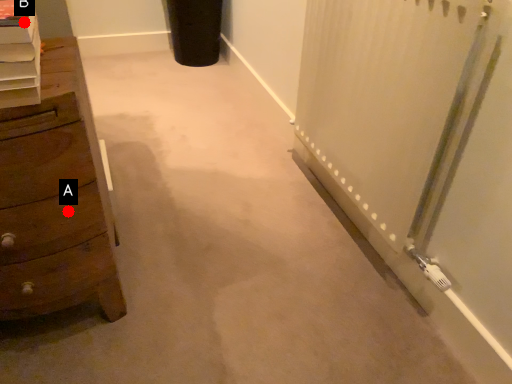
Question: Two points are circled on the image, labeled by A and B beside each circle. Which point is closer to the camera?

Choices:
 (A) A is closer
 (B) B is closer

Answer: (B)